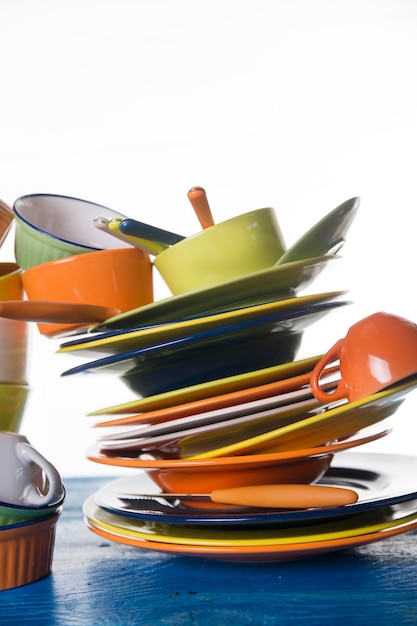
This screenshot has width=417, height=626. Find the location of `cups`. cups is located at coordinates (87, 285), (20, 467), (205, 258), (384, 345).